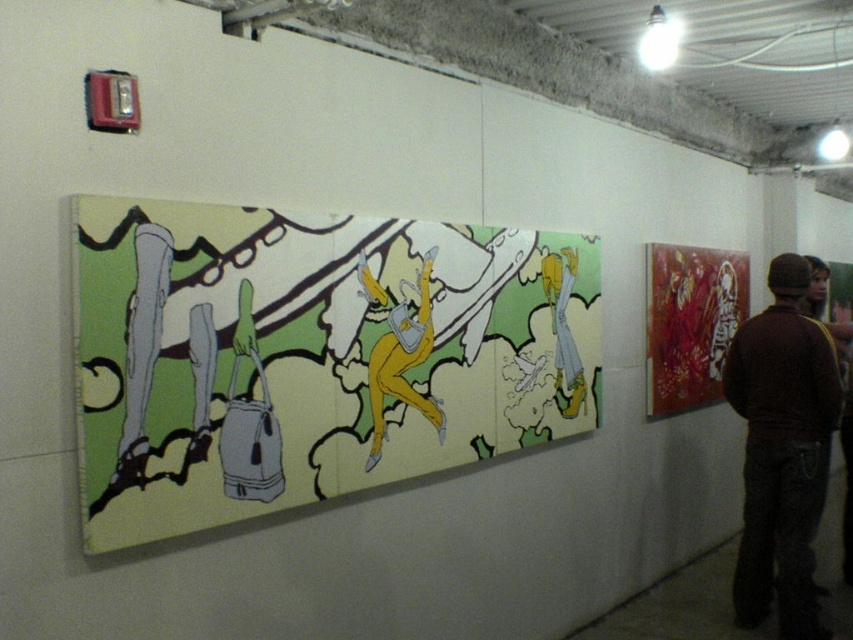
Question: Which point appears farthest from the camera in this image?

Choices:
 (A) (776, 396)
 (B) (160, 253)

Answer: (A)

Question: Does matte canvas painting at center appear on the left side of brown sweater at right?

Choices:
 (A) yes
 (B) no

Answer: (A)

Question: Can you confirm if matte canvas painting at center is positioned to the left of brown sweater at right?

Choices:
 (A) yes
 (B) no

Answer: (A)

Question: Does matte canvas painting at center have a smaller size compared to brown sweater at right?

Choices:
 (A) yes
 (B) no

Answer: (B)

Question: Which point is closer to the camera?

Choices:
 (A) (788, 388)
 (B) (430, 348)

Answer: (B)